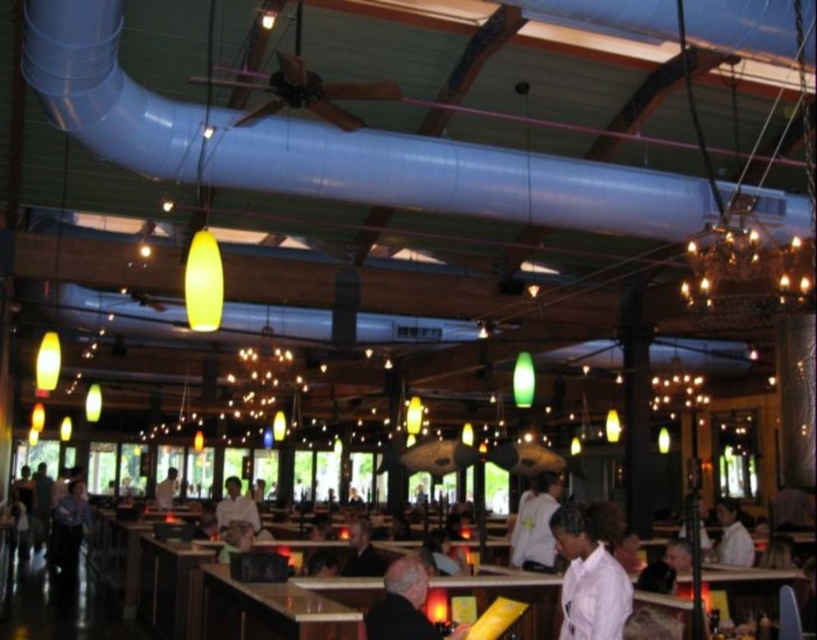
Question: Among these objects, which one is nearest to the camera?

Choices:
 (A) dark brown leather jacket at center
 (B) white matte shirt at center

Answer: (A)

Question: Is white matte uniform at center smaller than dark gray sweater at center?

Choices:
 (A) yes
 (B) no

Answer: (B)

Question: Can you confirm if white matte shirt at center is positioned below white shirt at center?

Choices:
 (A) no
 (B) yes

Answer: (A)

Question: Which of the following is the farthest from the observer?

Choices:
 (A) (547, 566)
 (B) (230, 493)
 (C) (420, 632)

Answer: (B)

Question: Which of the following is the closest to the observer?

Choices:
 (A) (417, 560)
 (B) (362, 522)

Answer: (A)

Question: Can you confirm if white matte uniform at center is positioned above white matte shirt at center?

Choices:
 (A) yes
 (B) no

Answer: (A)